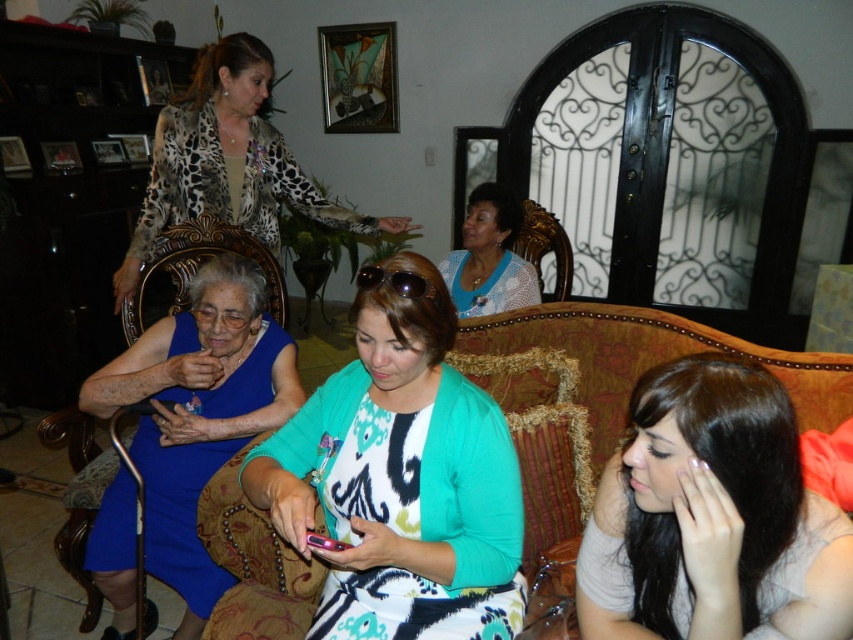
Question: From the image, what is the correct spatial relationship of smooth gray shirt at lower right in relation to blue dotted blouse at center?

Choices:
 (A) right
 (B) left

Answer: (A)

Question: Is blue satin dress at lower left positioned behind blue dotted blouse at center?

Choices:
 (A) no
 (B) yes

Answer: (A)

Question: Which is nearer to the leopard print jacket at upper left?

Choices:
 (A) teal fabric shirt at center
 (B) blue satin dress at lower left
 (C) pink glossy smartphone at center
 (D) smooth gray shirt at lower right

Answer: (B)

Question: Can you confirm if teal fabric shirt at center is wider than smooth gray shirt at lower right?

Choices:
 (A) no
 (B) yes

Answer: (B)

Question: Among these objects, which one is nearest to the camera?

Choices:
 (A) blue dotted blouse at center
 (B) teal fabric shirt at center

Answer: (B)

Question: Which point appears closest to the camera in this image?

Choices:
 (A) (403, 292)
 (B) (310, 532)
 (C) (531, 291)

Answer: (B)